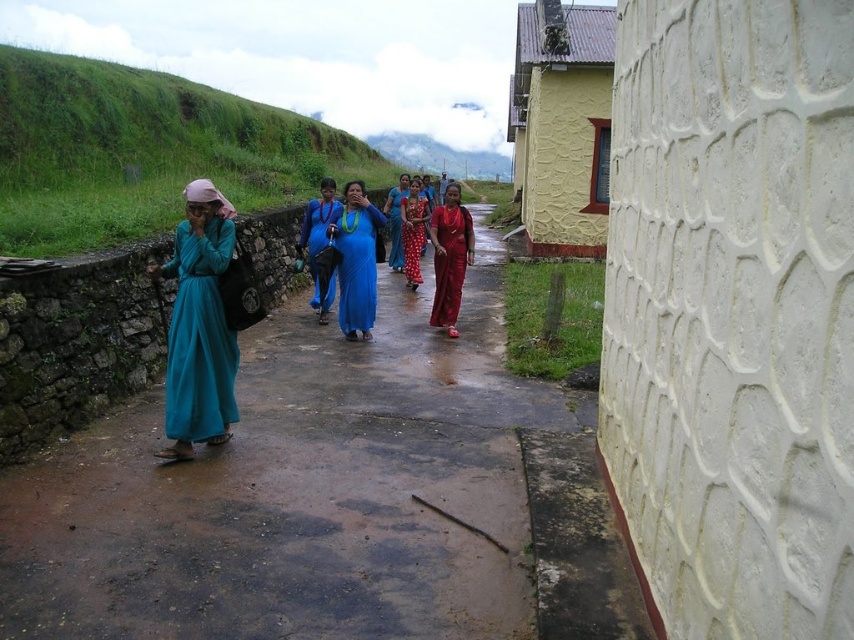
Based on the photo, you are a photographer trying to capture both the shiny red dress at center and the polka dot dress at center in the same frame. Which dress should you focus on first if you want to ensure both are in focus, considering their sizes?

The shiny red dress at center is smaller than the polka dot dress at center, so you should focus on the polka dot dress at center first to ensure both are in focus, as focusing on the larger object helps maintain depth of field for the smaller one.